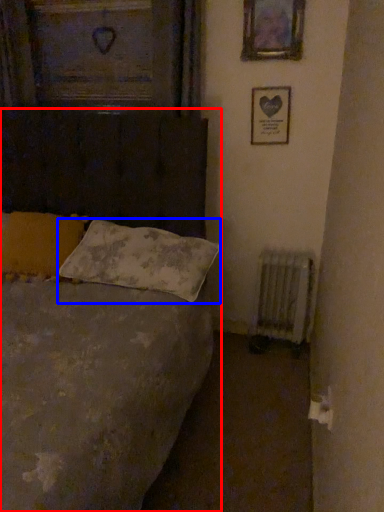
Question: Which of the following is the farthest to the observer, bed (highlighted by a red box) or pillow (highlighted by a blue box)?

Choices:
 (A) bed
 (B) pillow

Answer: (B)